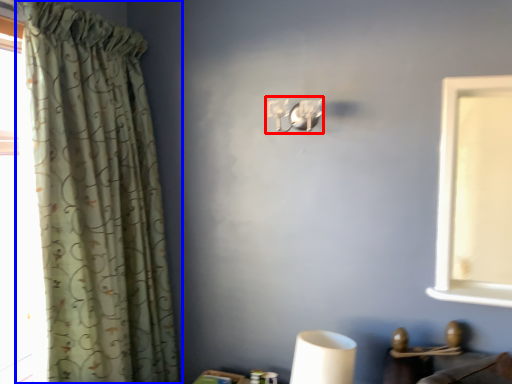
Question: Which of the following is the farthest to the observer, lamp (highlighted by a red box) or curtain (highlighted by a blue box)?

Choices:
 (A) lamp
 (B) curtain

Answer: (A)